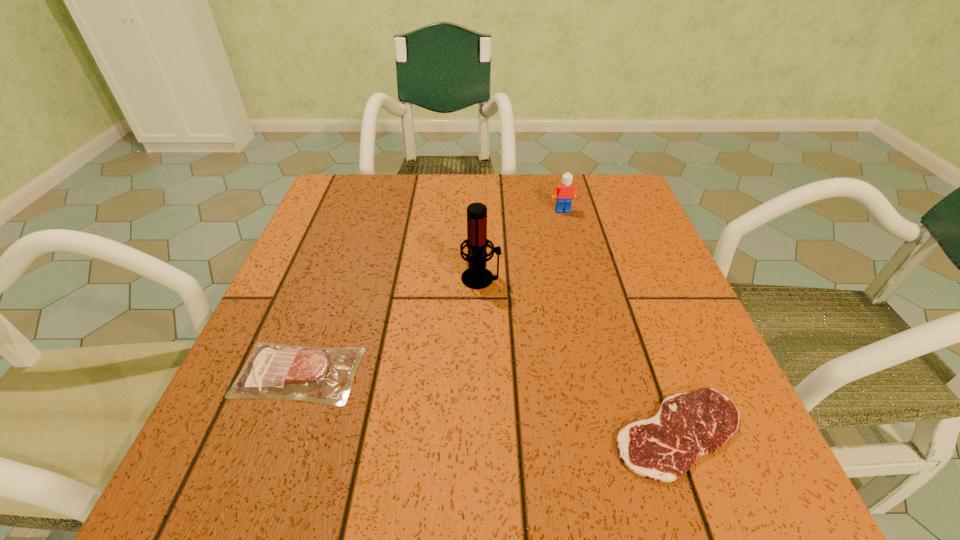
This screenshot has width=960, height=540. In order to click on the third object from right to left in this screenshot , I will do `click(477, 276)`.

You are a GUI agent. You are given a task and a screenshot of the screen. Output one action in this format:
    pyautogui.click(x=<x>, y=<y>)
    Task: Click on the tallest object
    The width and height of the screenshot is (960, 540).
    Given the screenshot: What is the action you would take?
    pyautogui.click(x=477, y=276)

Where is `Lego`? The image size is (960, 540). Lego is located at coordinates (565, 192).

The image size is (960, 540). In order to click on the farthest object in this screenshot , I will do `click(565, 192)`.

Find the location of a particular element. This screenshot has height=540, width=960. the left steak is located at coordinates (323, 375).

Locate an element on the screen. Image resolution: width=960 pixels, height=540 pixels. the third tallest object is located at coordinates (323, 375).

At what (x,y) coordinates should I click in order to perform the action: click on the shortest object. Please return your answer as a coordinate pair (x, y). This screenshot has width=960, height=540. Looking at the image, I should click on (688, 425).

Locate an element on the screen. Image resolution: width=960 pixels, height=540 pixels. the shorter steak is located at coordinates (688, 425).

At what (x,y) coordinates should I click in order to perform the action: click on free space located 0.050m on the right of the second object from left to right. Please return your answer as a coordinate pair (x, y). Looking at the image, I should click on (526, 278).

The width and height of the screenshot is (960, 540). I want to click on free space located on the face of the farthest object, so click(x=577, y=266).